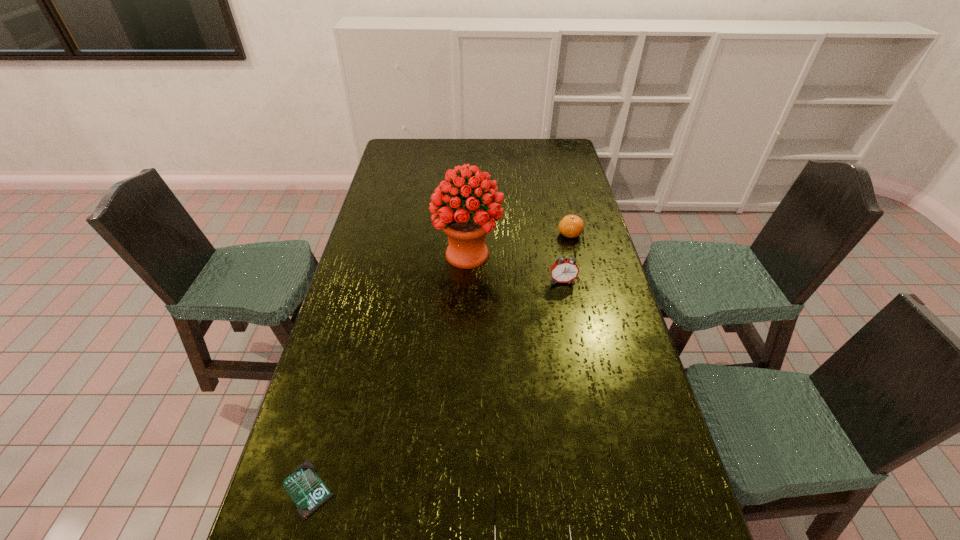
Locate an element on the screen. The height and width of the screenshot is (540, 960). object at the left edge is located at coordinates (304, 486).

Locate an element on the screen. alarm clock that is positioned at the right edge is located at coordinates (566, 270).

Where is `clementine situated at the right edge`? clementine situated at the right edge is located at coordinates (571, 226).

You are a GUI agent. You are given a task and a screenshot of the screen. Output one action in this format:
    pyautogui.click(x=<x>, y=<y>)
    Task: Click on the vacant space at the far edge of the desktop
    
    Given the screenshot: What is the action you would take?
    pyautogui.click(x=521, y=158)

In the image, there is a desktop. Where is `vacant space at the left edge`? The height and width of the screenshot is (540, 960). vacant space at the left edge is located at coordinates (410, 191).

Image resolution: width=960 pixels, height=540 pixels. I want to click on free region at the right edge, so click(x=561, y=197).

The height and width of the screenshot is (540, 960). In the image, there is a desktop. In order to click on free region at the far right corner in this screenshot , I will do point(549,148).

Image resolution: width=960 pixels, height=540 pixels. Identify the location of free space between the shortest object and the third nearest object. (436, 385).

Locate an element on the screen. This screenshot has height=540, width=960. free spot between the third tallest object and the bouquet is located at coordinates (518, 244).

This screenshot has height=540, width=960. Identify the location of empty space between the shortest object and the second tallest object. (436, 385).